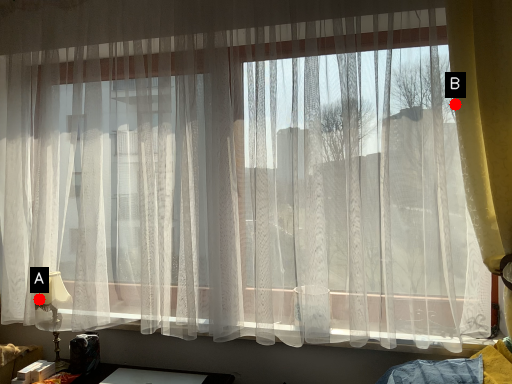
Question: Two points are circled on the image, labeled by A and B beside each circle. Which of the following is the closest to the observer?

Choices:
 (A) A is closer
 (B) B is closer

Answer: (B)